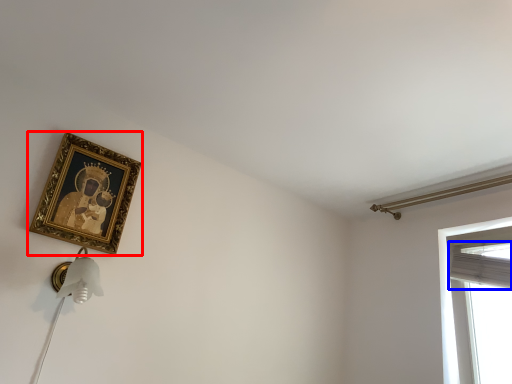
Question: Which of the following is the farthest to the observer, picture frame (highlighted by a red box) or curtain (highlighted by a blue box)?

Choices:
 (A) picture frame
 (B) curtain

Answer: (B)